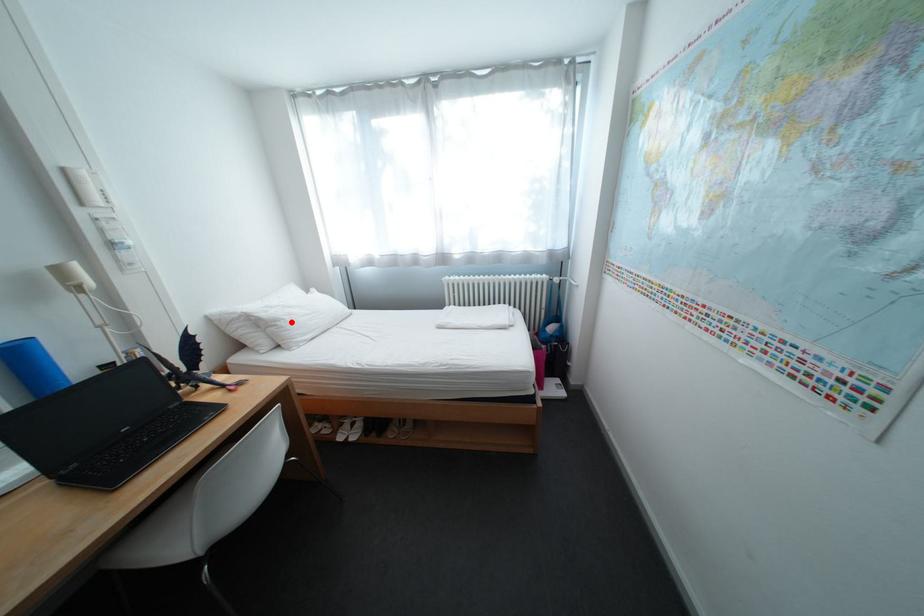
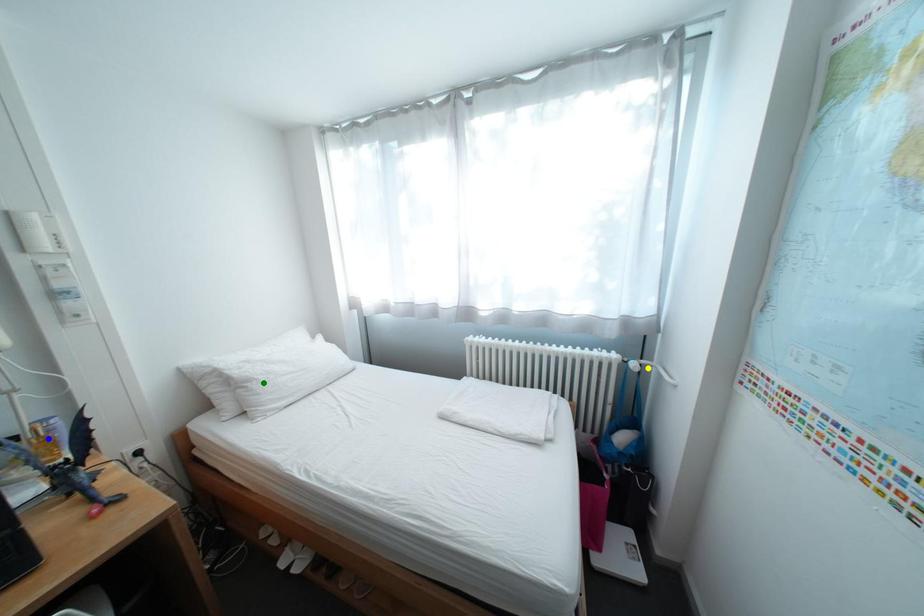
Question: I am providing you with two images of the same scene from different viewpoints. A red point is marked on the first image. You are given multiple points on the second image. Which point in image 2 represents the same 3d spot as the red point in image 1?

Choices:
 (A) blue point
 (B) yellow point
 (C) green point

Answer: (C)